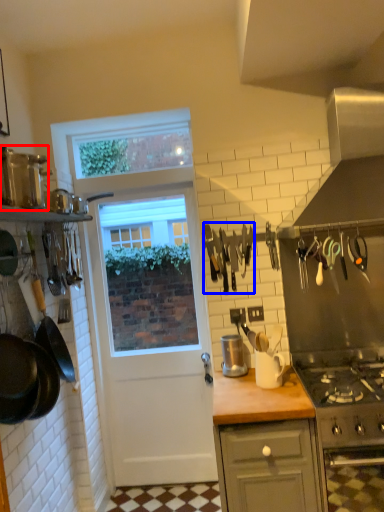
Question: Which point is closer to the camera, kitchen appliance (highlighted by a red box) or tool (highlighted by a blue box)?

Choices:
 (A) kitchen appliance
 (B) tool

Answer: (A)